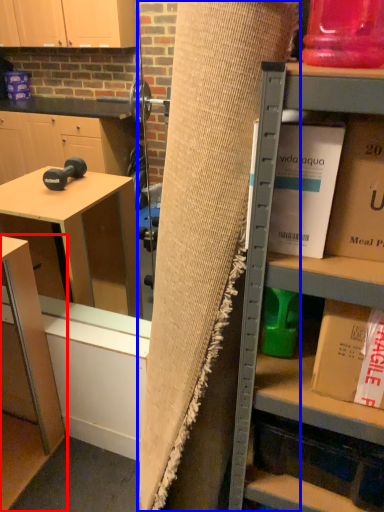
Question: Among these objects, which one is farthest to the camera, table (highlighted by a red box) or curtain (highlighted by a blue box)?

Choices:
 (A) table
 (B) curtain

Answer: (A)